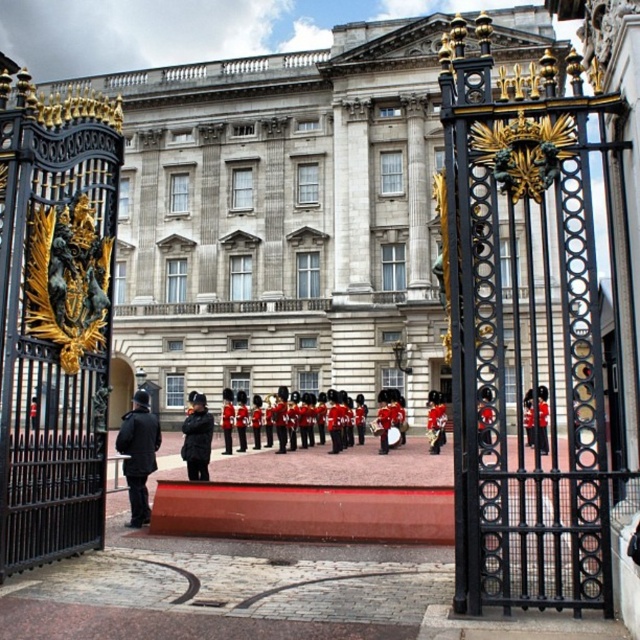
Question: Which point appears closest to the camera in this image?

Choices:
 (A) (109, 403)
 (B) (403, 417)
 (C) (193, 432)
 (D) (132, 492)

Answer: (D)

Question: Is black matte uniform at center bigger than black matte jacket at center?

Choices:
 (A) no
 (B) yes

Answer: (B)

Question: Considering the real-world distances, which object is closest to the black matte uniform at center?

Choices:
 (A) red velvet uniform at center
 (B) black matte jacket at center

Answer: (B)

Question: Is shiny red uniform at center positioned in front of red velvet uniform at center?

Choices:
 (A) no
 (B) yes

Answer: (A)

Question: Does black matte uniform at center have a lesser width compared to black matte jacket at center?

Choices:
 (A) yes
 (B) no

Answer: (B)

Question: Which is farther from the black matte uniform at center?

Choices:
 (A) white stone building at center
 (B) red velvet uniform at center
 (C) shiny red uniform at center
 (D) black matte jacket at center

Answer: (B)